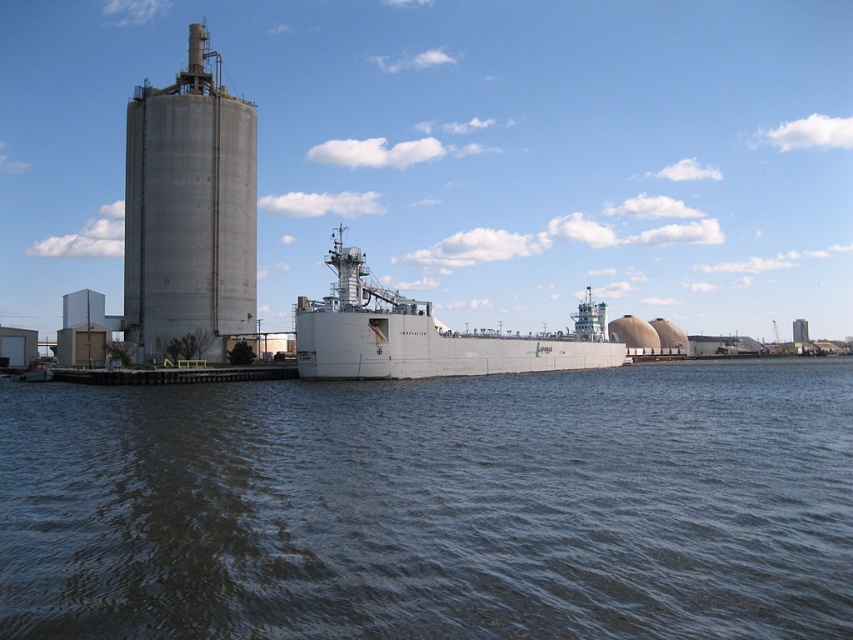
Question: Does dark blue water at center have a larger size compared to white matte ship at center?

Choices:
 (A) no
 (B) yes

Answer: (A)

Question: Among these objects, which one is farthest from the camera?

Choices:
 (A) concrete silo at left
 (B) white matte ship at center
 (C) dark blue water at center

Answer: (A)

Question: Does dark blue water at center appear under white matte ship at center?

Choices:
 (A) yes
 (B) no

Answer: (A)

Question: Which point is farther to the camera?

Choices:
 (A) (416, 547)
 (B) (254, 292)
 (C) (427, 372)

Answer: (B)

Question: Which object is the farthest from the concrete silo at left?

Choices:
 (A) white matte ship at center
 (B) dark blue water at center

Answer: (B)

Question: Is dark blue water at center wider than white matte ship at center?

Choices:
 (A) no
 (B) yes

Answer: (A)